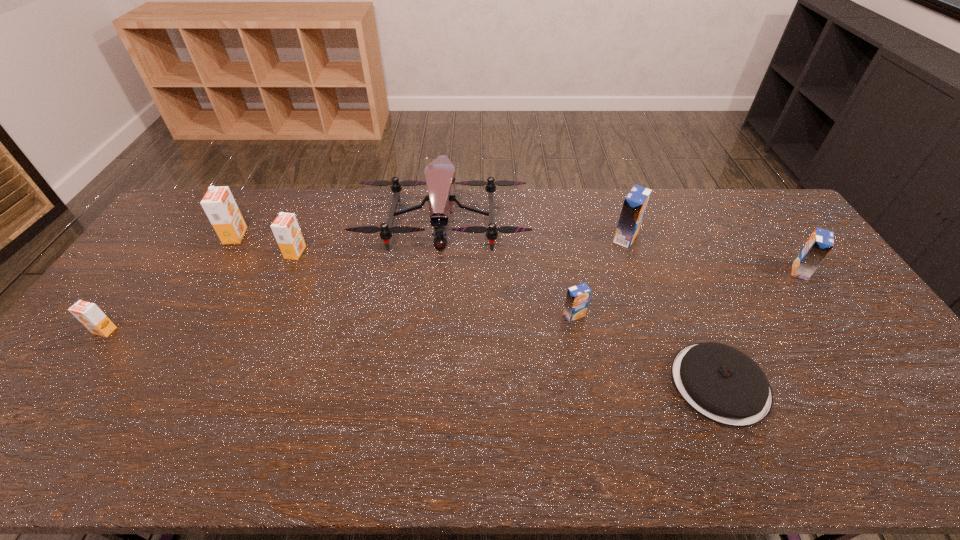
You are a GUI agent. You are given a task and a screenshot of the screen. Output one action in this format:
    pyautogui.click(x=<x>, y=<y>)
    Task: Click on the vacant area situated on the front of the third orange juice from left to right
    
    Given the screenshot: What is the action you would take?
    click(275, 300)

Locate an element on the screen. Image resolution: width=960 pixels, height=540 pixels. blank space located 0.120m on the front of the third orange juice from right to left is located at coordinates (583, 359).

Find the location of `free space located 0.200m on the right of the seventh farthest object`. free space located 0.200m on the right of the seventh farthest object is located at coordinates (187, 330).

Locate an element on the screen. The width and height of the screenshot is (960, 540). vacant region located 0.090m on the back of the nearest object is located at coordinates (692, 319).

The height and width of the screenshot is (540, 960). I want to click on drone that is at the far edge, so click(439, 174).

This screenshot has width=960, height=540. Find the location of `object that is at the near edge`. object that is at the near edge is located at coordinates (721, 383).

Where is `object located in the left edge section of the desktop`? object located in the left edge section of the desktop is located at coordinates pyautogui.click(x=89, y=314).

Locate an element on the screen. The image size is (960, 540). object located at the right edge is located at coordinates (820, 243).

At what (x,y) coordinates should I click in order to perform the action: click on free region at the far edge. Please return your answer as a coordinate pair (x, y). Looking at the image, I should click on (415, 201).

The height and width of the screenshot is (540, 960). In order to click on vacant space at the near edge of the desktop in this screenshot , I will do `click(522, 464)`.